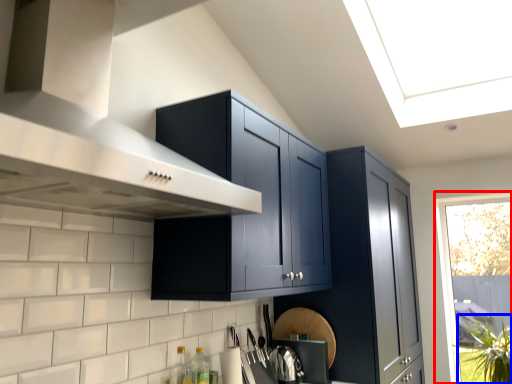
Question: Which object is further to the camera taking this photo, window (highlighted by a red box) or plant (highlighted by a blue box)?

Choices:
 (A) window
 (B) plant

Answer: (A)